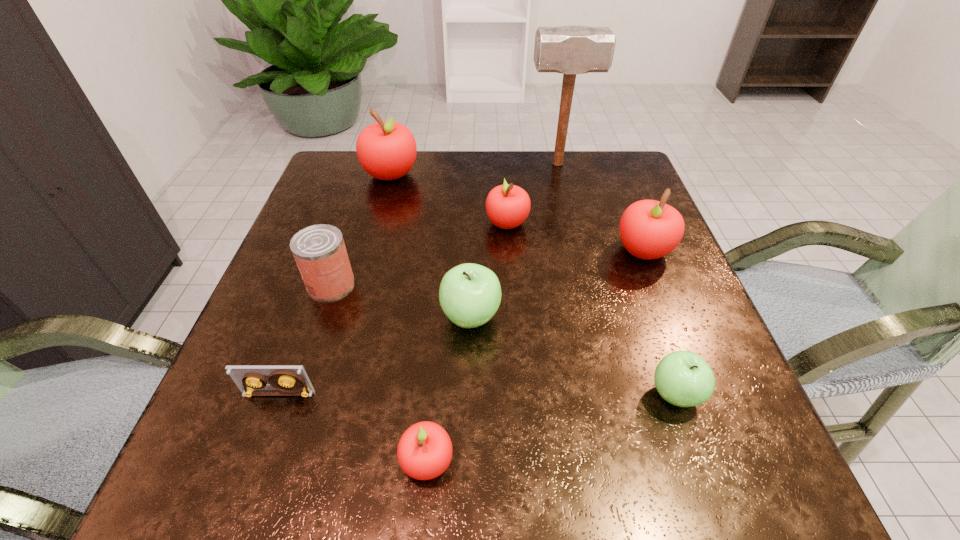
I want to click on free region located 0.260m on the back of the second red apple from right to left, so click(502, 155).

Identify the location of vacant point located on the back of the left green apple. (472, 227).

This screenshot has width=960, height=540. I want to click on free space located 0.320m on the front of the can, so click(270, 467).

You are a GUI agent. You are given a task and a screenshot of the screen. Output one action in this format:
    pyautogui.click(x=<x>, y=<y>)
    Task: Click on the vacant region located on the left of the smaller green apple
    
    Given the screenshot: What is the action you would take?
    pyautogui.click(x=476, y=394)

Identify the location of free spot located on the right of the nearest red apple. (x=599, y=461).

The width and height of the screenshot is (960, 540). I want to click on vacant space situated at the front of the brown videotape with visible reels, so click(x=245, y=489).

This screenshot has width=960, height=540. Find the location of `mallet that is at the far edge`. mallet that is at the far edge is located at coordinates (571, 49).

This screenshot has height=540, width=960. I want to click on apple present at the far edge, so click(386, 150).

You are a GUI agent. You are given a task and a screenshot of the screen. Output one action in this format:
    pyautogui.click(x=<x>, y=<y>)
    Task: Click on the object situated at the near edge
    The image size is (960, 540).
    Given the screenshot: What is the action you would take?
    pyautogui.click(x=424, y=452)

The width and height of the screenshot is (960, 540). What are the coordinates of `apple at the left edge` in the screenshot? It's located at (386, 150).